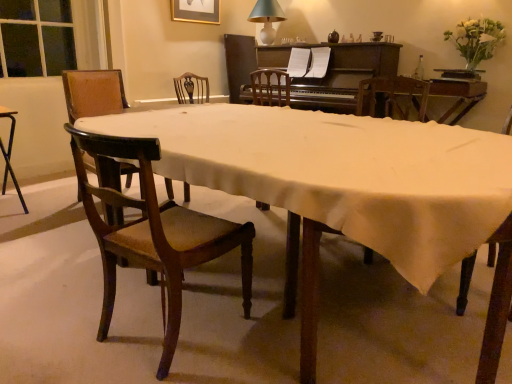
Locate an element on the screen. The height and width of the screenshot is (384, 512). gold-framed picture at upper center is located at coordinates (196, 11).

This screenshot has height=384, width=512. Find the location of `white matte flowers at upper right`. white matte flowers at upper right is located at coordinates (476, 40).

In order to click on wooden table at center in this screenshot , I will do `click(350, 190)`.

The width and height of the screenshot is (512, 384). Describe the element at coordinates (335, 72) in the screenshot. I see `dark brown polished wood piano at upper center` at that location.

The image size is (512, 384). I want to click on mahogany wood chair at lower left, the second chair positioned from the back, so click(x=155, y=234).

The height and width of the screenshot is (384, 512). I want to click on white ceramic lamp at upper center, so point(267,18).

Considering their positions, is dark brown polished wood piano at upper center located in front of or behind mahogany wood chair at lower left, the first chair viewed from the front?

Clearly, dark brown polished wood piano at upper center is behind mahogany wood chair at lower left, the first chair viewed from the front.

Measure the distance between dark brown polished wood piano at upper center and mahogany wood chair at lower left, the first chair viewed from the front.

A distance of 2.55 meters exists between dark brown polished wood piano at upper center and mahogany wood chair at lower left, the first chair viewed from the front.

Consider the image. What's the angular difference between dark brown polished wood piano at upper center and mahogany wood chair at lower left, the first chair viewed from the front,'s facing directions?

173 degrees.

Is dark brown polished wood piano at upper center far from mahogany wood chair at lower left, the second chair positioned from the back?

Yes, dark brown polished wood piano at upper center and mahogany wood chair at lower left, the second chair positioned from the back, are quite far apart.

Is dark brown polished wood piano at upper center thinner than white matte flowers at upper right?

In fact, dark brown polished wood piano at upper center might be wider than white matte flowers at upper right.

In the scene shown: Does dark brown polished wood piano at upper center turn towards white matte flowers at upper right?

No, dark brown polished wood piano at upper center is not aimed at white matte flowers at upper right.

From the image's perspective, does dark brown polished wood piano at upper center appear lower than white matte flowers at upper right?

Yes.

Could you measure the distance between dark brown polished wood piano at upper center and white matte flowers at upper right?

dark brown polished wood piano at upper center is 30.33 inches away from white matte flowers at upper right.

What are the coordinates of `flower lying above the wooden chair at left, which appears as the second chair when viewed from the right (from the image's perspective)` in the screenshot? It's located at (476, 40).

From the image's perspective, which is above, white matte flowers at upper right or wooden chair at left, which is counted as the 1th chair, starting from the left?

white matte flowers at upper right.

Which object is thinner, white matte flowers at upper right or wooden chair at left, which appears as the second chair when viewed from the front?

white matte flowers at upper right is thinner.

Is point (463, 53) more distant than point (82, 107)?

Yes, point (463, 53) is farther from viewer.

Which of these two, mahogany wood chair at lower left, the second chair from the left, or white ceramic lamp at upper center, is thinner?

white ceramic lamp at upper center.

Which is in front, point (179, 307) or point (259, 13)?

The point (179, 307) is closer to the camera.

Is mahogany wood chair at lower left, the second chair from the left, to the left or to the right of white ceramic lamp at upper center in the image?

mahogany wood chair at lower left, the second chair from the left, is positioned on white ceramic lamp at upper center's left side.

Considering the sizes of objects white ceramic lamp at upper center and mahogany wood chair at lower left, the second chair from the left, in the image provided, who is bigger, white ceramic lamp at upper center or mahogany wood chair at lower left, the second chair from the left,?

mahogany wood chair at lower left, the second chair from the left.

Is white ceramic lamp at upper center turned away from mahogany wood chair at lower left, the second chair positioned from the back?

No.

In terms of width, does white ceramic lamp at upper center look wider or thinner when compared to mahogany wood chair at lower left, the second chair from the left?

In the image, white ceramic lamp at upper center appears to be more narrow than mahogany wood chair at lower left, the second chair from the left.

Considering the sizes of objects white ceramic lamp at upper center and mahogany wood chair at lower left, positioned as the 1th chair in right-to-left order, in the image provided, who is shorter, white ceramic lamp at upper center or mahogany wood chair at lower left, positioned as the 1th chair in right-to-left order,?

Standing shorter between the two is white ceramic lamp at upper center.

Which object is positioned more to the left, wooden table at center or white matte flowers at upper right?

wooden table at center is more to the left.

From a real-world perspective, which object rests below the other?

wooden table at center is physically lower.

From the image's perspective, relative to white matte flowers at upper right, is wooden table at center above or below?

wooden table at center is situated lower than white matte flowers at upper right in the image.

How different are the orientations of wooden table at center and white matte flowers at upper right in degrees?

wooden table at center and white matte flowers at upper right are facing 0.203 degrees away from each other.

Is white matte flowers at upper right completely or partially outside of dark brown polished wood piano at upper center?

white matte flowers at upper right lies outside dark brown polished wood piano at upper center's area.

From a real-world perspective, which object rests below the other?

dark brown polished wood piano at upper center.

Is white matte flowers at upper right in contact with dark brown polished wood piano at upper center?

No, white matte flowers at upper right is not touching dark brown polished wood piano at upper center.

From the picture: Which object is more forward, white matte flowers at upper right or dark brown polished wood piano at upper center?

white matte flowers at upper right is more forward.

From a real-world perspective, starting from the dark brown polished wood piano at upper center, which chair is the 2nd one below it? Please provide its 2D coordinates.

[(155, 234)]

Identify the location of flower that is above the dark brown polished wood piano at upper center (from the image's perspective). The height and width of the screenshot is (384, 512). (476, 40).

Considering their positions, is dark brown polished wood piano at upper center positioned closer to white ceramic lamp at upper center than wooden table at center?

dark brown polished wood piano at upper center.

Estimate the real-world distances between objects in this image. Which object is further from white matte flowers at upper right, black metal desk at left or wooden table at center?

black metal desk at left is further to white matte flowers at upper right.

When comparing their distances from white ceramic lamp at upper center, does gold-framed picture at upper center or dark brown polished wood piano at upper center seem closer?

The object closer to white ceramic lamp at upper center is gold-framed picture at upper center.

From the image, which object appears to be farther from gold-framed picture at upper center, dark brown polished wood piano at upper center or wooden chair at left, which appears as the second chair when viewed from the front?

dark brown polished wood piano at upper center.

Which object lies nearer to the anchor point gold-framed picture at upper center, white matte flowers at upper right or wooden chair at left, which is counted as the 1th chair, starting from the left?

Among the two, wooden chair at left, which is counted as the 1th chair, starting from the left, is located nearer to gold-framed picture at upper center.

When comparing their distances from gold-framed picture at upper center, does white matte flowers at upper right or mahogany wood chair at lower left, positioned as the 1th chair in right-to-left order, seem closer?

white matte flowers at upper right.

Estimate the real-world distances between objects in this image. Which object is further from wooden chair at left, placed as the first chair when sorted from back to front, black metal desk at left or wooden table at center?

wooden table at center is further to wooden chair at left, placed as the first chair when sorted from back to front.

Considering their positions, is white matte flowers at upper right positioned closer to black metal desk at left than dark brown polished wood piano at upper center?

Based on the image, dark brown polished wood piano at upper center appears to be nearer to black metal desk at left.

The image size is (512, 384). Identify the location of lamp situated between wooden chair at left, which appears as the second chair when viewed from the right, and white matte flowers at upper right from left to right. (267, 18).

This screenshot has height=384, width=512. I want to click on flower between mahogany wood chair at lower left, the second chair from the left, and dark brown polished wood piano at upper center in the front-back direction, so click(476, 40).

Locate an element on the screen. This screenshot has width=512, height=384. piano located between wooden table at center and gold-framed picture at upper center in the depth direction is located at coordinates (335, 72).

At what (x,y) coordinates should I click in order to perform the action: click on piano between wooden chair at left, which is counted as the 1th chair, starting from the left, and white matte flowers at upper right. Please return your answer as a coordinate pair (x, y). Looking at the image, I should click on (335, 72).